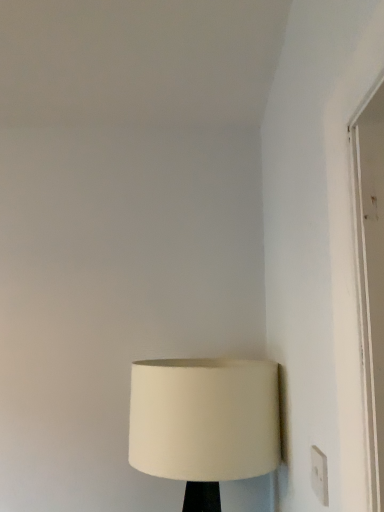
Describe the element at coordinates (204, 423) in the screenshot. I see `white fabric lampshade at lower center` at that location.

Locate an element on the screen. white fabric lampshade at lower center is located at coordinates (204, 423).

I want to click on white plastic electric outlet at lower right, so click(x=319, y=475).

What do you see at coordinates (319, 475) in the screenshot? The height and width of the screenshot is (512, 384). I see `white plastic electric outlet at lower right` at bounding box center [319, 475].

Image resolution: width=384 pixels, height=512 pixels. In order to click on white fabric lampshade at lower center in this screenshot , I will do coord(204,423).

Visually, is white fabric lampshade at lower center positioned to the left or to the right of white plastic electric outlet at lower right?

white fabric lampshade at lower center is to the left of white plastic electric outlet at lower right.

In the image, is white fabric lampshade at lower center positioned in front of or behind white plastic electric outlet at lower right?

Visually, white fabric lampshade at lower center is located behind white plastic electric outlet at lower right.

Between point (153, 447) and point (325, 481), which one is positioned in front?

The point (325, 481) is closer.

From the image's perspective, which is below, white fabric lampshade at lower center or white plastic electric outlet at lower right?

From the image's view, white fabric lampshade at lower center is below.

From a real-world perspective, which is physically above, white fabric lampshade at lower center or white plastic electric outlet at lower right?

white plastic electric outlet at lower right.

Considering the relative sizes of white fabric lampshade at lower center and white plastic electric outlet at lower right in the image provided, is white fabric lampshade at lower center wider than white plastic electric outlet at lower right?

Correct, the width of white fabric lampshade at lower center exceeds that of white plastic electric outlet at lower right.

Considering the sizes of white fabric lampshade at lower center and white plastic electric outlet at lower right in the image, is white fabric lampshade at lower center taller or shorter than white plastic electric outlet at lower right?

Clearly, white fabric lampshade at lower center is taller compared to white plastic electric outlet at lower right.

Between white fabric lampshade at lower center and white plastic electric outlet at lower right, which one has smaller size?

Smaller between the two is white plastic electric outlet at lower right.

Is white fabric lampshade at lower center not within white plastic electric outlet at lower right?

white fabric lampshade at lower center is positioned outside white plastic electric outlet at lower right.

Would you say white fabric lampshade at lower center is a long distance from white plastic electric outlet at lower right?

No, white fabric lampshade at lower center is in close proximity to white plastic electric outlet at lower right.

Could you tell me if white fabric lampshade at lower center is turned towards white plastic electric outlet at lower right?

Yes, white fabric lampshade at lower center is aimed at white plastic electric outlet at lower right.

You are a GUI agent. You are given a task and a screenshot of the screen. Output one action in this format:
    pyautogui.click(x=<x>, y=<y>)
    Task: Click on the lamp lying below the white plastic electric outlet at lower right (from the image's perspective)
    Image resolution: width=384 pixels, height=512 pixels.
    Given the screenshot: What is the action you would take?
    pyautogui.click(x=204, y=423)

Looking at this image, which is more to the right, white plastic electric outlet at lower right or white fabric lampshade at lower center?

white plastic electric outlet at lower right.

Relative to white fabric lampshade at lower center, is white plastic electric outlet at lower right in front or behind?

In the image, white plastic electric outlet at lower right appears in front of white fabric lampshade at lower center.

Is point (313, 465) positioned before point (137, 456)?

Yes, it is in front of point (137, 456).

Consider the image. From the image's perspective, is white plastic electric outlet at lower right located beneath white fabric lampshade at lower center?

Actually, white plastic electric outlet at lower right appears above white fabric lampshade at lower center in the image.

From a real-world perspective, is white plastic electric outlet at lower right physically below white fabric lampshade at lower center?

Incorrect, from a real-world perspective, white plastic electric outlet at lower right is higher than white fabric lampshade at lower center.

Which object is wider, white plastic electric outlet at lower right or white fabric lampshade at lower center?

white fabric lampshade at lower center.

Based on the photo, does white plastic electric outlet at lower right have a lesser height compared to white fabric lampshade at lower center?

Yes, white plastic electric outlet at lower right is shorter than white fabric lampshade at lower center.

Which of these two, white plastic electric outlet at lower right or white fabric lampshade at lower center, is smaller?

white plastic electric outlet at lower right.

Is white plastic electric outlet at lower right not inside white fabric lampshade at lower center?

Yes.

Would you say white plastic electric outlet at lower right is a long distance from white fabric lampshade at lower center?

white plastic electric outlet at lower right is actually quite close to white fabric lampshade at lower center.

Could you tell me if white plastic electric outlet at lower right is turned towards white fabric lampshade at lower center?

No, white plastic electric outlet at lower right does not turn towards white fabric lampshade at lower center.

In the image, there is a white fabric lampshade at lower center. Where is `electric outlet above it (from the image's perspective)`? electric outlet above it (from the image's perspective) is located at coordinates (319, 475).

The image size is (384, 512). In order to click on lamp on the left of white plastic electric outlet at lower right in this screenshot , I will do `click(204, 423)`.

Identify the location of lamp that is below the white plastic electric outlet at lower right (from the image's perspective). (204, 423).